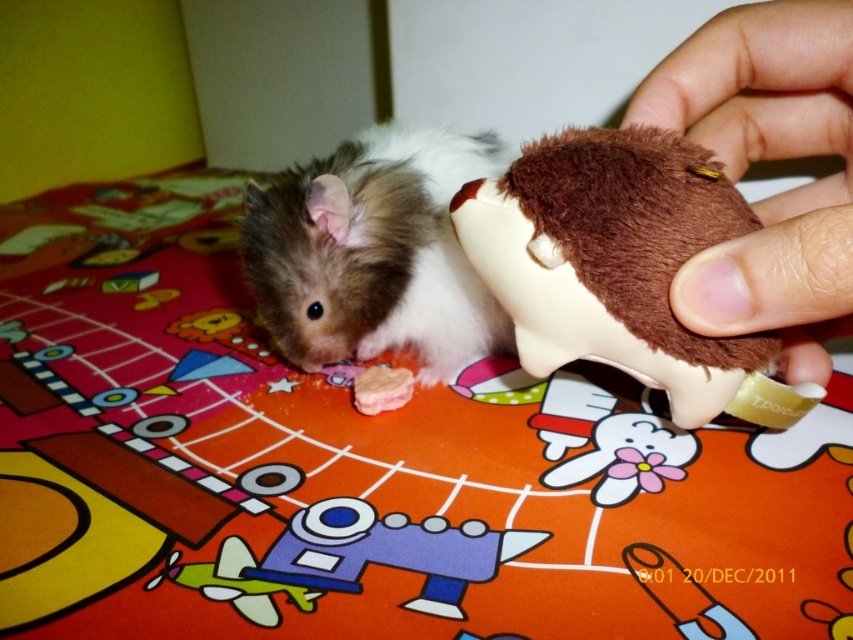
Question: Is brown plush toy at center further to the viewer compared to fuzzy brown mouse at center?

Choices:
 (A) yes
 (B) no

Answer: (B)

Question: Which point appears closest to the camera in this image?

Choices:
 (A) (627, 118)
 (B) (527, 164)

Answer: (B)

Question: In this image, where is brown fuzzy toy at upper right located relative to fuzzy brown mouse at center?

Choices:
 (A) above
 (B) below

Answer: (B)

Question: From the image, what is the correct spatial relationship of brown fuzzy toy at upper right in relation to fuzzy brown mouse at center?

Choices:
 (A) above
 (B) below

Answer: (B)

Question: Among these points, which one is nearest to the camera?

Choices:
 (A) (721, 275)
 (B) (410, 168)
 (C) (561, 266)

Answer: (A)

Question: Among these points, which one is nearest to the camera?

Choices:
 (A) (347, 276)
 (B) (788, 129)

Answer: (B)